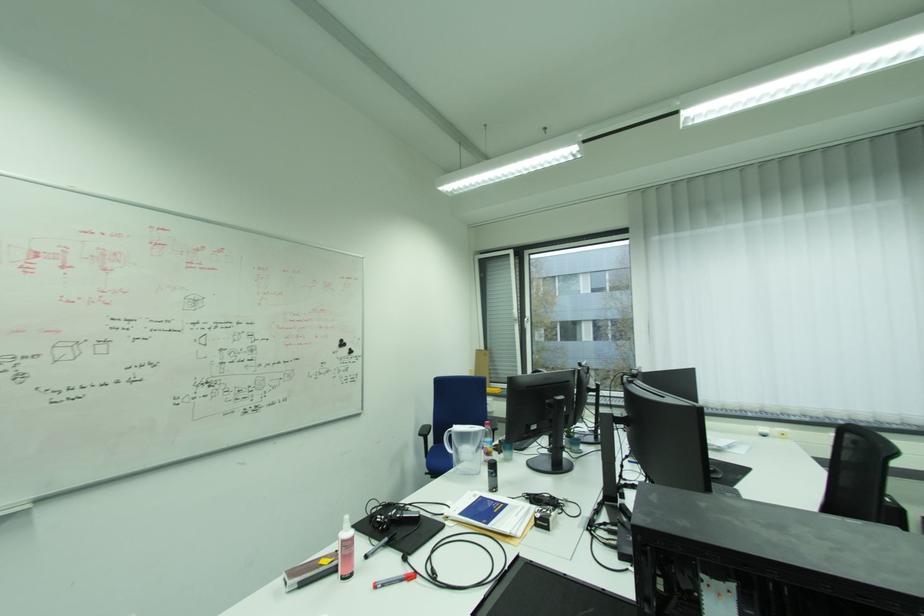
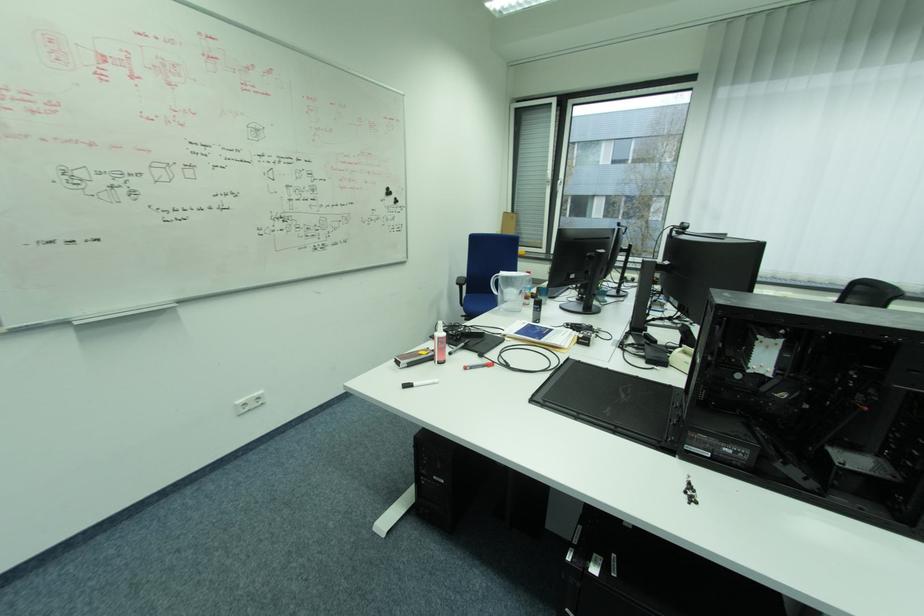
Where in the second image is the point corresponding to the point at 383,586 from the first image?

(472, 369)